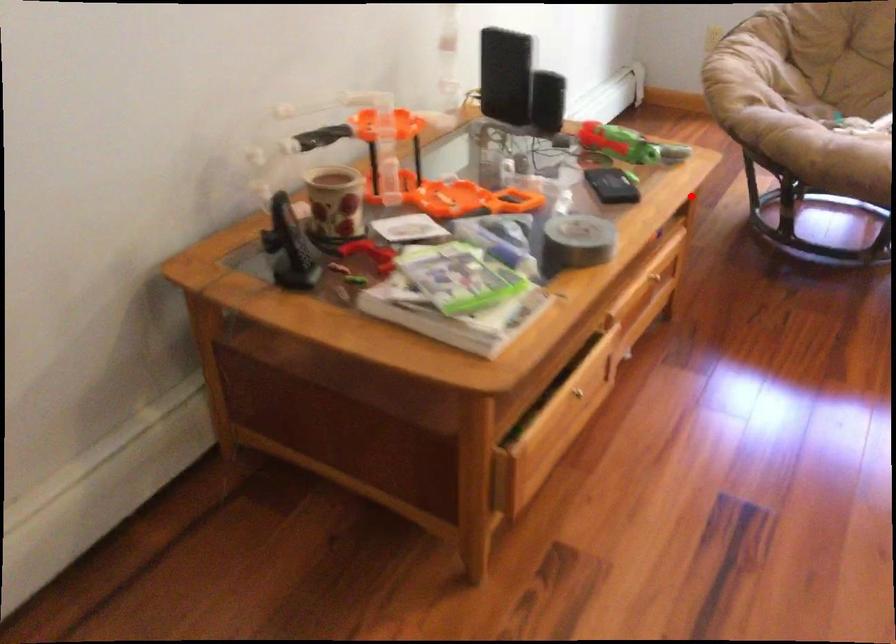
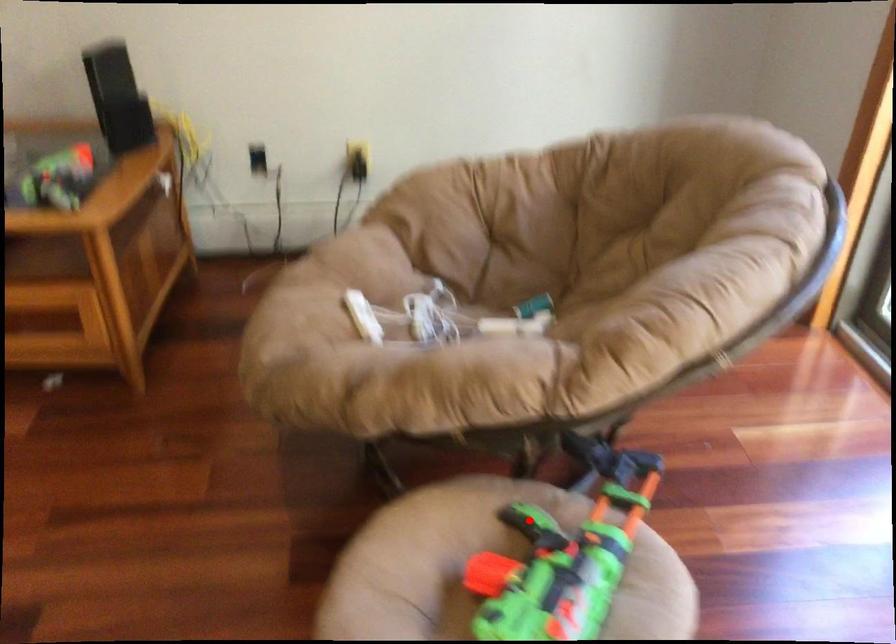
I am providing you with two images of the same scene from different viewpoints. A red point is marked on the first image and another point is marked on the second image. Does the point marked in image1 correspond to the same location as the one in image2?

No